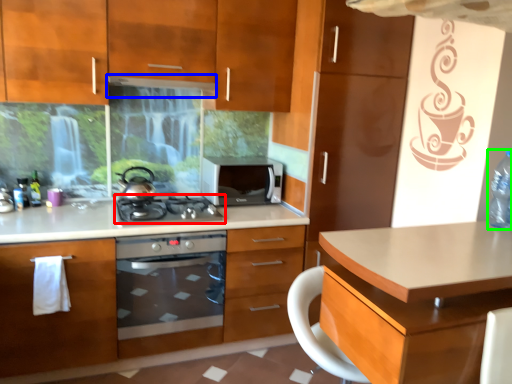
Question: Which is farther away from gas stove (highlighted by a red box)? exhaust hood (highlighted by a blue box) or bottle (highlighted by a green box)?

Choices:
 (A) exhaust hood
 (B) bottle

Answer: (B)